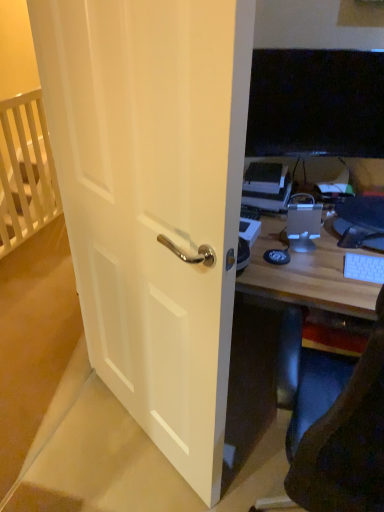
Question: From a real-world perspective, relative to white wooden crib at upper left, is satin silver desktop at center vertically above or below?

Choices:
 (A) below
 (B) above

Answer: (B)

Question: Considering the positions of satin silver desktop at center and white wooden crib at upper left in the image, is satin silver desktop at center taller or shorter than white wooden crib at upper left?

Choices:
 (A) tall
 (B) short

Answer: (B)

Question: Based on their relative distances, which object is nearer to the white wooden crib at upper left?

Choices:
 (A) black rubber mousepad at center
 (B) white matte door at center
 (C) black glossy monitor at upper right
 (D) satin silver desktop at center
 (E) white plastic keyboard at right

Answer: (B)

Question: Which object is positioned farthest from the white plastic keyboard at right?

Choices:
 (A) white matte door at center
 (B) satin silver desktop at center
 (C) white wooden crib at upper left
 (D) black rubber mousepad at center
 (E) black glossy monitor at upper right

Answer: (C)